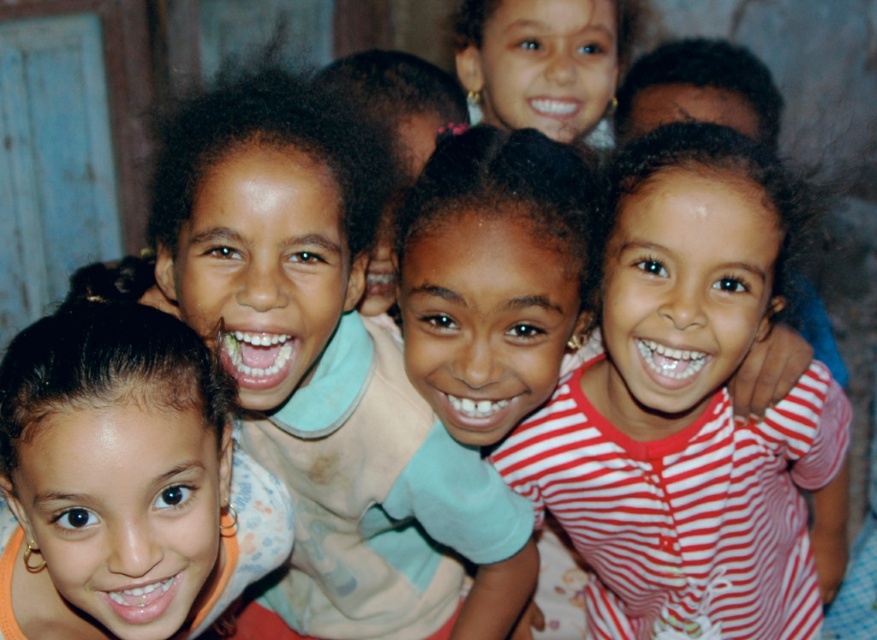
Does red striped shirt at center appear over matte black hair at upper center?

No.

Is red striped shirt at center below matte black hair at upper center?

Indeed, red striped shirt at center is positioned under matte black hair at upper center.

Is point (660, 618) positioned in front of point (518, 81)?

Yes, point (660, 618) is closer to viewer.

You are a GUI agent. You are given a task and a screenshot of the screen. Output one action in this format:
    pyautogui.click(x=<x>, y=<y>)
    Task: Click on the red striped shirt at center
    
    Given the screenshot: What is the action you would take?
    pyautogui.click(x=687, y=406)

Is the position of matte orange shirt at lower left more distant than that of matte black hair at upper center?

No, matte orange shirt at lower left is in front of matte black hair at upper center.

Does matte orange shirt at lower left appear under matte black hair at upper center?

Correct, matte orange shirt at lower left is located below matte black hair at upper center.

You are a GUI agent. You are given a task and a screenshot of the screen. Output one action in this format:
    pyautogui.click(x=<x>, y=<y>)
    Task: Click on the matte orange shirt at lower left
    This screenshot has width=877, height=640.
    Given the screenshot: What is the action you would take?
    pyautogui.click(x=125, y=481)

Can you confirm if red striped shirt at center is positioned above matte orange shirt at lower left?

Indeed, red striped shirt at center is positioned over matte orange shirt at lower left.

Does point (669, 483) come in front of point (227, 531)?

No.

This screenshot has height=640, width=877. What do you see at coordinates (687, 406) in the screenshot?
I see `red striped shirt at center` at bounding box center [687, 406].

Locate an element on the screen. This screenshot has height=640, width=877. red striped shirt at center is located at coordinates (687, 406).